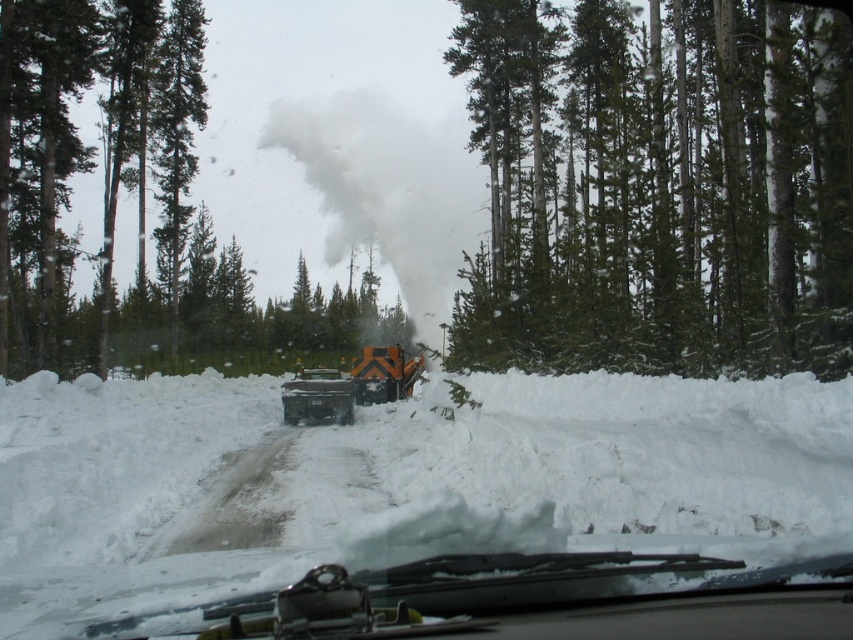
Question: Which point is farther to the camera?

Choices:
 (A) tap(265, 557)
 (B) tap(631, 88)
 (C) tap(366, 348)

Answer: (C)

Question: Is white fluffy snow at center positioned at the back of white powdery smoke at center?

Choices:
 (A) yes
 (B) no

Answer: (B)

Question: Which of the following is the farthest from the observer?

Choices:
 (A) (456, 296)
 (B) (13, 348)
 (C) (451, 433)
 (D) (386, 364)

Answer: (A)

Question: Can you confirm if white fluffy snow at center is bigger than green textured tree at upper left?

Choices:
 (A) no
 (B) yes

Answer: (A)

Question: Among these points, which one is farthest from the camera?

Choices:
 (A) (401, 378)
 (B) (801, 554)

Answer: (A)

Question: Is white fluffy snow at center above green textured tree at center?

Choices:
 (A) no
 (B) yes

Answer: (A)